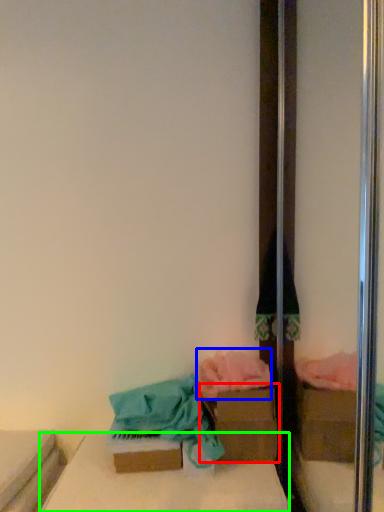
Question: Which is farther away from cardboard box (highlighted by a red box)? material (highlighted by a blue box) or furniture (highlighted by a green box)?

Choices:
 (A) material
 (B) furniture

Answer: (B)